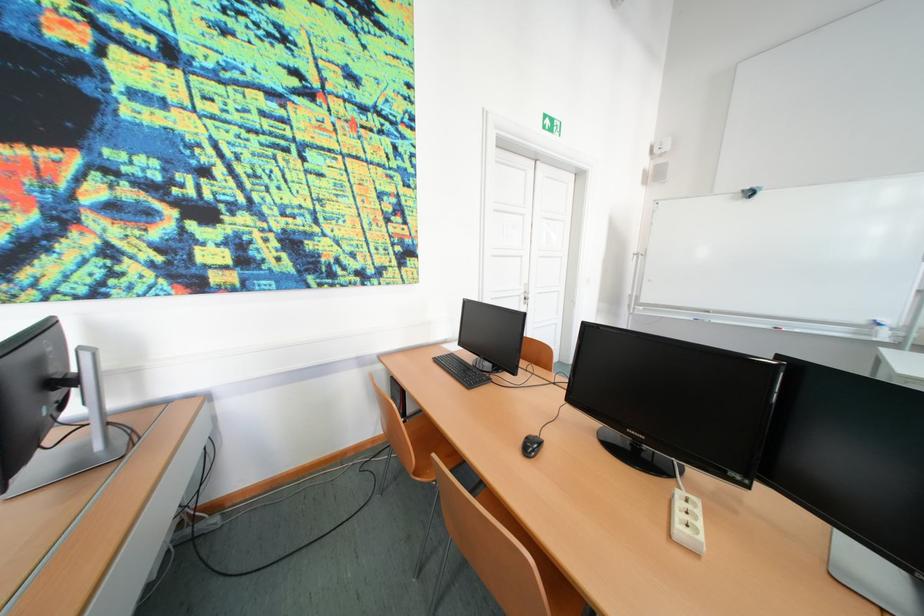
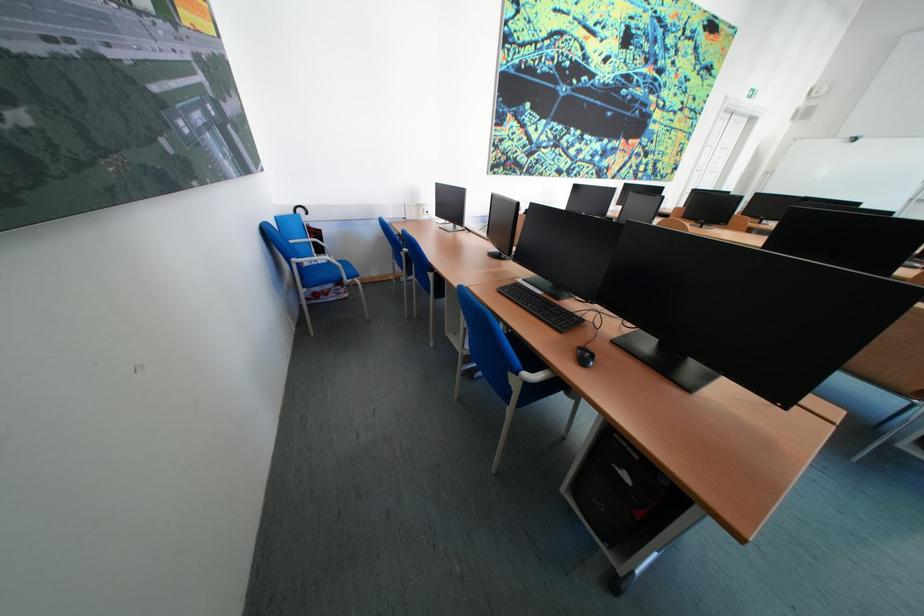
Question: I am providing you with two images of the same scene from different viewpoints. Which of the following objects are not visible in image2?

Choices:
 (A) blue pencil case
 (B) blue whiteboard eraser
 (C) black computer mouse
 (D) blue chair armrest

Answer: (B)